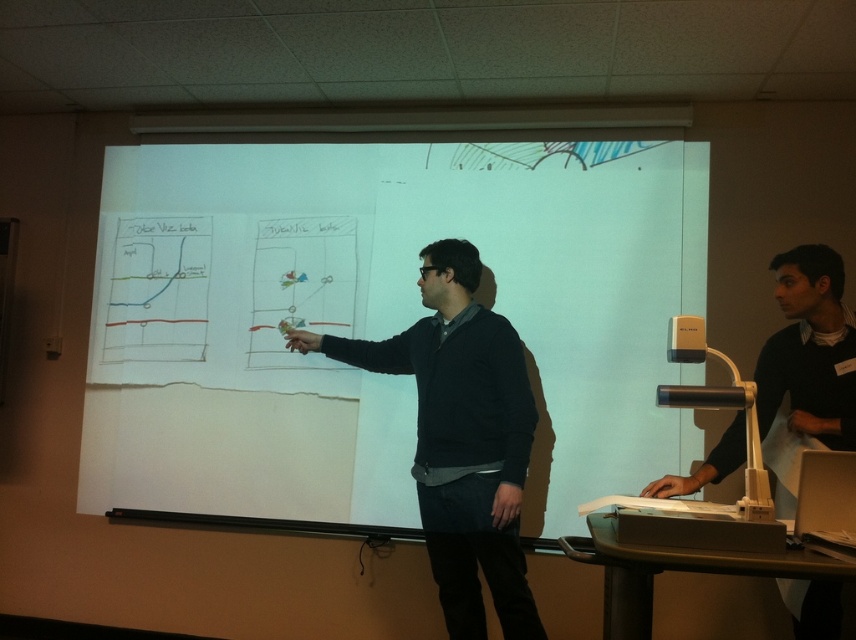
Does white matte projection screen at center appear on the left side of matte white projector at lower center?

Indeed, white matte projection screen at center is positioned on the left side of matte white projector at lower center.

Who is more forward, (333,499) or (739,541)?

Point (739,541)

Find the location of `white matte projection screen at center`. white matte projection screen at center is located at coordinates (378, 317).

Is white matte projection screen at center to the left of dark blue sweater at center from the viewer's perspective?

Correct, you'll find white matte projection screen at center to the left of dark blue sweater at center.

Does white matte projection screen at center have a lesser height compared to dark blue sweater at center?

In fact, white matte projection screen at center may be taller than dark blue sweater at center.

Is point (507, 275) farther from viewer compared to point (461, 476)?

Yes.

I want to click on white matte projection screen at center, so click(378, 317).

Is dark blue sweater at center below matte white projector at lower center?

No.

Which is behind, point (510, 440) or point (771, 520)?

Positioned behind is point (510, 440).

You are a GUI agent. You are given a task and a screenshot of the screen. Output one action in this format:
    pyautogui.click(x=<x>, y=<y>)
    Task: Click on the dark blue sweater at center
    
    Given the screenshot: What is the action you would take?
    pyautogui.click(x=461, y=438)